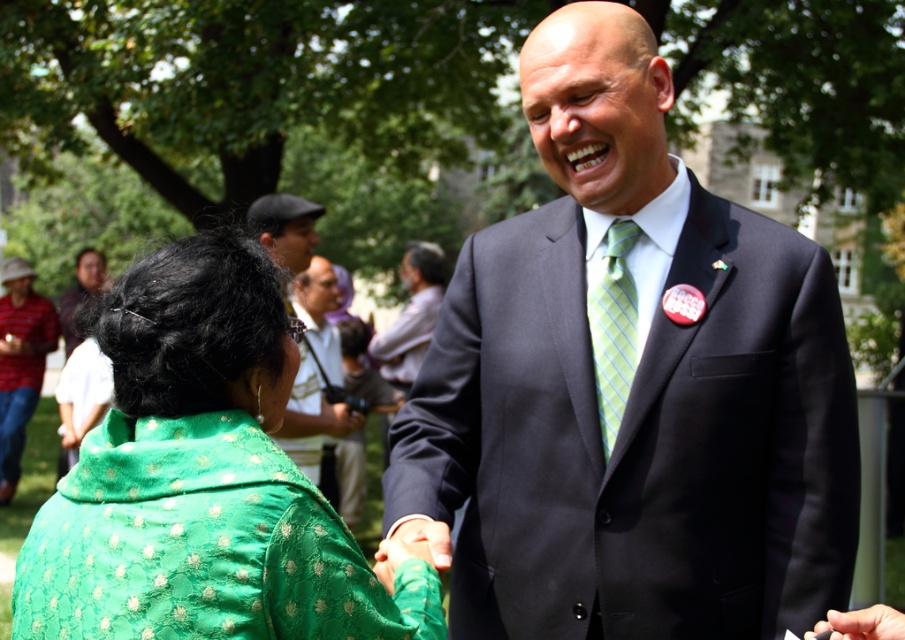
Is point (435, 250) behind point (299, 257)?

Yes, it is behind point (299, 257).

Who is lower down, light purple shirt at center or matte black cap at upper center?

light purple shirt at center is lower down.

Locate an element on the screen. The width and height of the screenshot is (905, 640). light purple shirt at center is located at coordinates (411, 316).

Locate an element on the screen. The image size is (905, 640). light purple shirt at center is located at coordinates (411, 316).

In the scene shown: Is green plaid tie at center taller than matte black suit at upper center?

No, green plaid tie at center is not taller than matte black suit at upper center.

Who is more forward, (599,422) or (65,339)?

Point (599,422) is in front.

The width and height of the screenshot is (905, 640). What do you see at coordinates (613, 330) in the screenshot?
I see `green plaid tie at center` at bounding box center [613, 330].

I want to click on green plaid tie at center, so click(613, 330).

Does light purple shirt at center appear over matte black suit at upper center?

Actually, light purple shirt at center is below matte black suit at upper center.

The image size is (905, 640). Describe the element at coordinates (411, 316) in the screenshot. I see `light purple shirt at center` at that location.

What do you see at coordinates (411, 316) in the screenshot?
I see `light purple shirt at center` at bounding box center [411, 316].

The height and width of the screenshot is (640, 905). Identify the location of light purple shirt at center. (411, 316).